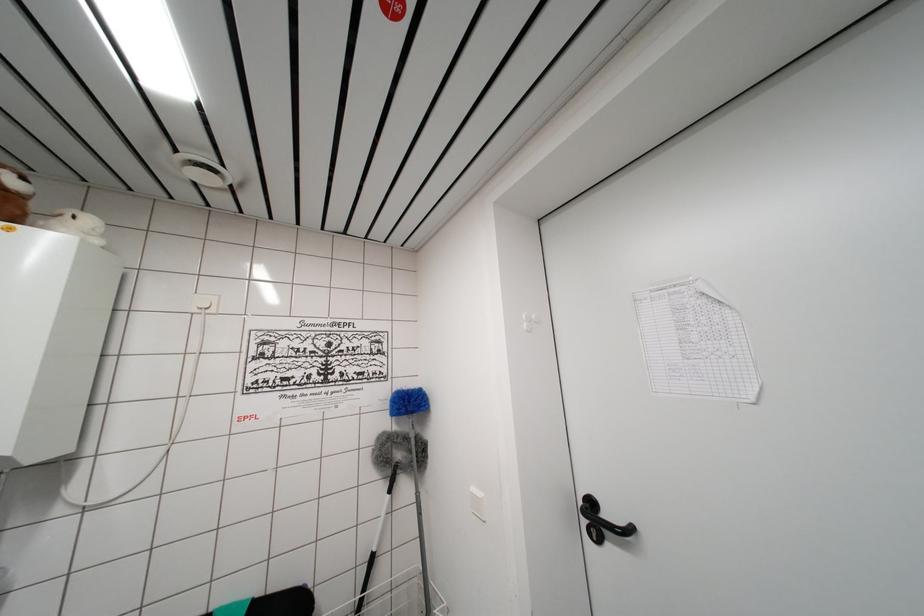
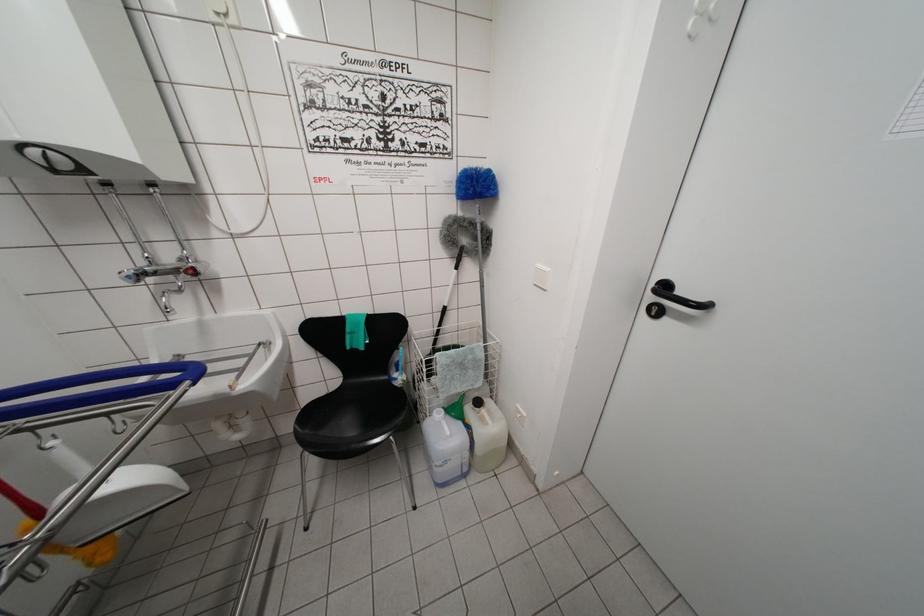
Question: Based on the continuous images, in which direction is the camera rotating? Reply with the corresponding letter.

Choices:
 (A) Left
 (B) Right
 (C) Up
 (D) Down

Answer: (D)